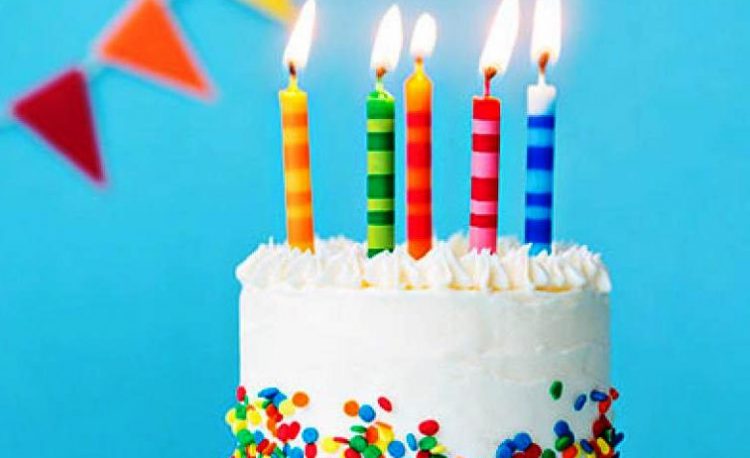
At what (x,y) coordinates should I click in order to perform the action: click on candle flames. Please return your answer as a coordinate pair (x, y). Looking at the image, I should click on (307, 35), (386, 52), (420, 42), (488, 45), (544, 43).